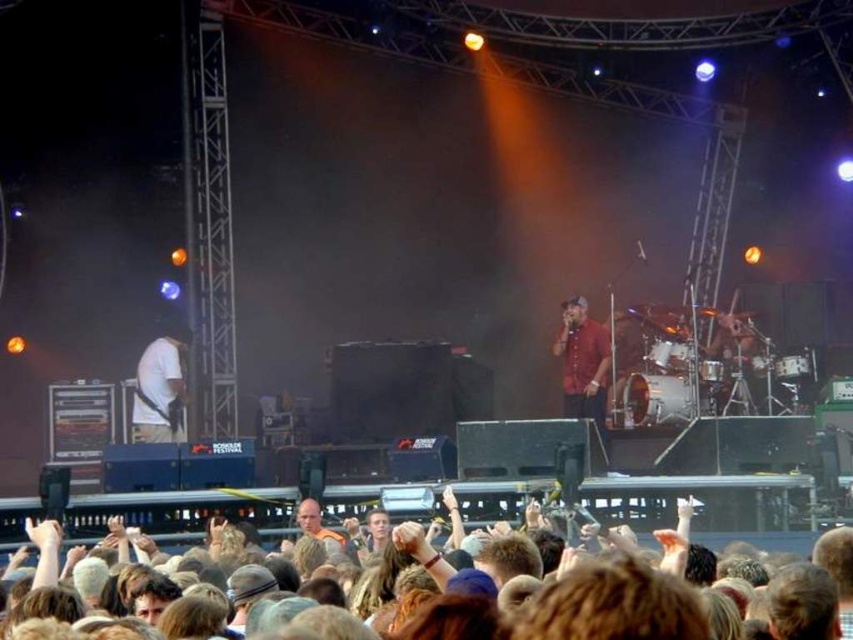
You are a photographer at the concert. You want to capture a photo that includes both the red matte shirt at center and the white matte guitar at left. Based on their positions, which object should you focus on first to ensure both are in frame?

The red matte shirt at center is located above the white matte guitar at left, so you should focus on the white matte guitar at left first to ensure both are in frame.

You are a photographer standing at the front of the stage. You want to take a photo of the drummer behind the drums on the right side of the stage. There are two points marked in the image at coordinates point (585,358) and point (166,362). Which point is closer to your camera position?

Point (166,362) is closer to the camera because it is closer to the photographer than point (585,358), which is further away.

You are a stagehand who needs to retrieve the white matte guitar at left from the stage. The brown hair at lower center is blocking your path. Can you walk straight to the guitar without detouring? Please consider the distance between them.

The distance between brown hair at lower center and white matte guitar at left is 16.23 meters, so you can walk straight to the guitar without detouring since the distance is sufficient.